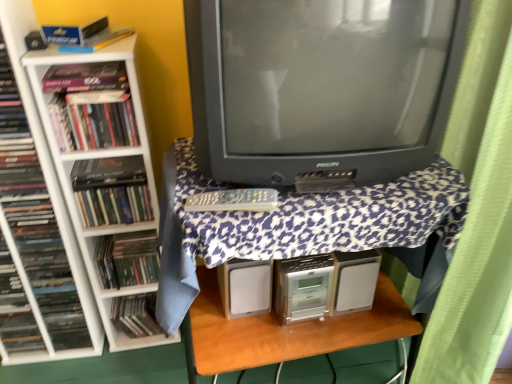
Question: From the image's perspective, is matte black book at left, the 1th book from the left, over matte black book at left, which ranks as the 5th book in right-to-left order?

Choices:
 (A) no
 (B) yes

Answer: (B)

Question: Does matte black book at left, the 1th book from the left, have a lesser width compared to matte black book at left, acting as the third book starting from the left?

Choices:
 (A) yes
 (B) no

Answer: (B)

Question: Is matte black book at left, the 7th book in the right-to-left sequence, looking in the opposite direction of matte black book at left, acting as the third book starting from the left?

Choices:
 (A) yes
 (B) no

Answer: (B)

Question: Does matte black book at left, the 1th book from the left, come in front of matte black book at left, which ranks as the 5th book in right-to-left order?

Choices:
 (A) no
 (B) yes

Answer: (B)

Question: Does matte black book at left, the 7th book in the right-to-left sequence, turn towards matte black book at left, acting as the third book starting from the left?

Choices:
 (A) yes
 (B) no

Answer: (B)

Question: Is point (472, 263) closer or farther from the camera than point (178, 336)?

Choices:
 (A) farther
 (B) closer

Answer: (B)

Question: Considering their positions, is green fabric curtain at right located in front of or behind white plastic bookcase at left?

Choices:
 (A) front
 (B) behind

Answer: (A)

Question: Considering the positions of green fabric curtain at right and white plastic bookcase at left in the image, is green fabric curtain at right taller or shorter than white plastic bookcase at left?

Choices:
 (A) tall
 (B) short

Answer: (A)

Question: Visually, is green fabric curtain at right positioned to the left or to the right of white plastic bookcase at left?

Choices:
 (A) left
 (B) right

Answer: (B)

Question: Is matte black speaker at upper left situated inside matte black book at left, the first book when ordered from right to left, or outside?

Choices:
 (A) inside
 (B) outside

Answer: (B)

Question: In terms of width, does matte black speaker at upper left look wider or thinner when compared to matte black book at left, acting as the seventh book starting from the left?

Choices:
 (A) wide
 (B) thin

Answer: (B)

Question: From the image's perspective, relative to matte black book at left, acting as the seventh book starting from the left, is matte black speaker at upper left above or below?

Choices:
 (A) above
 (B) below

Answer: (A)

Question: Is point (30, 38) positioned closer to the camera than point (104, 249)?

Choices:
 (A) closer
 (B) farther

Answer: (A)

Question: Is point (9, 296) closer or farther from the camera than point (124, 46)?

Choices:
 (A) closer
 (B) farther

Answer: (B)

Question: Looking at their shapes, would you say matte black book at left, the 1th book from the left, is wider or thinner than white plastic bookcase at left?

Choices:
 (A) wide
 (B) thin

Answer: (B)